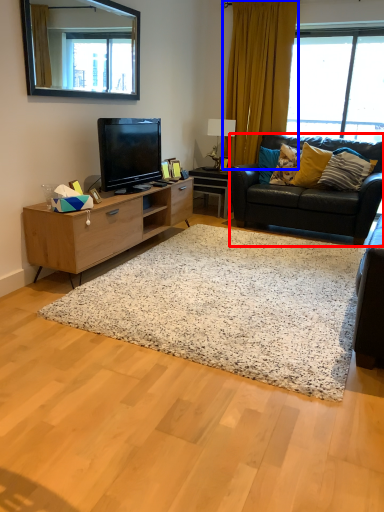
Question: Which object is closer to the camera taking this photo, studio couch (highlighted by a red box) or curtain (highlighted by a blue box)?

Choices:
 (A) studio couch
 (B) curtain

Answer: (A)